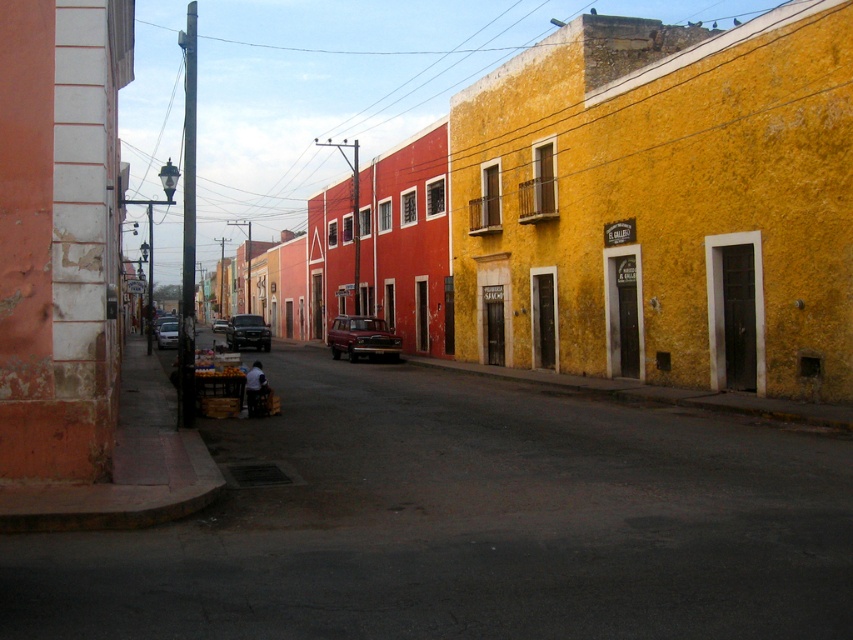
Is shiny red car at center bigger than shiny black car at center?

No.

Is shiny red car at center closer to the viewer compared to shiny black car at center?

Result: Yes.

Does point (354, 356) come closer to viewer compared to point (245, 337)?

Yes, it is in front of point (245, 337).

Image resolution: width=853 pixels, height=640 pixels. I want to click on shiny red car at center, so click(x=363, y=337).

Is shiny black car at center below metallic silver car at center-left?

Actually, shiny black car at center is above metallic silver car at center-left.

Does shiny black car at center have a greater width compared to metallic silver car at center-left?

Yes.

Locate an element on the screen. The height and width of the screenshot is (640, 853). shiny black car at center is located at coordinates (247, 332).

In order to click on shiny black car at center in this screenshot , I will do `click(247, 332)`.

Does metallic silver car at center-left come in front of metallic silver truck at center?

Yes, it is.

Is point (173, 323) in front of point (212, 330)?

Yes, it is in front of point (212, 330).

Locate an element on the screen. metallic silver car at center-left is located at coordinates (167, 333).

The height and width of the screenshot is (640, 853). In order to click on metallic silver car at center-left in this screenshot , I will do `click(167, 333)`.